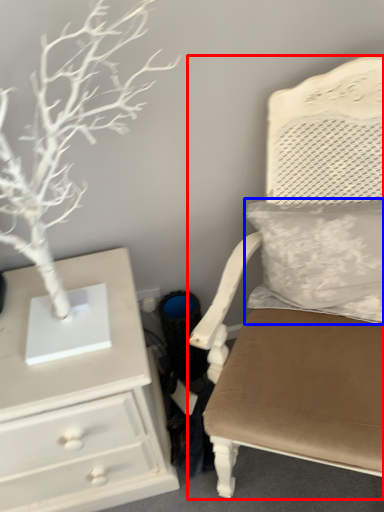
Question: Among these objects, which one is farthest to the camera, chair (highlighted by a red box) or pillow (highlighted by a blue box)?

Choices:
 (A) chair
 (B) pillow

Answer: (B)